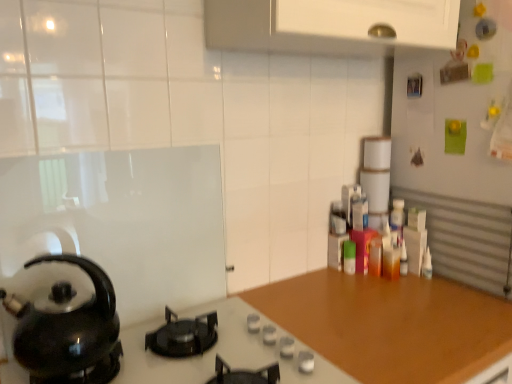
Question: From a real-world perspective, is black glossy kettle at left located beneath black matte gas stove at center?

Choices:
 (A) no
 (B) yes

Answer: (A)

Question: From a real-world perspective, is black glossy kettle at left on top of black matte gas stove at center?

Choices:
 (A) yes
 (B) no

Answer: (A)

Question: Is black glossy kettle at left not within black matte gas stove at center?

Choices:
 (A) no
 (B) yes

Answer: (B)

Question: Considering the relative sizes of black glossy kettle at left and black matte gas stove at center in the image provided, is black glossy kettle at left bigger than black matte gas stove at center?

Choices:
 (A) yes
 (B) no

Answer: (B)

Question: Considering the relative sizes of black glossy kettle at left and black matte gas stove at center in the image provided, is black glossy kettle at left wider than black matte gas stove at center?

Choices:
 (A) yes
 (B) no

Answer: (B)

Question: Is black glossy kettle at left smaller than black matte gas stove at center?

Choices:
 (A) yes
 (B) no

Answer: (A)

Question: Can you confirm if wooden at center is taller than black matte gas stove at center?

Choices:
 (A) yes
 (B) no

Answer: (A)

Question: Is the depth of wooden at center greater than that of black matte gas stove at center?

Choices:
 (A) yes
 (B) no

Answer: (A)

Question: From the image's perspective, would you say wooden at center is positioned over black matte gas stove at center?

Choices:
 (A) yes
 (B) no

Answer: (B)

Question: Is wooden at center to the right of black matte gas stove at center from the viewer's perspective?

Choices:
 (A) no
 (B) yes

Answer: (B)

Question: Can you confirm if wooden at center is thinner than black matte gas stove at center?

Choices:
 (A) yes
 (B) no

Answer: (B)

Question: From a real-world perspective, is wooden at center under black matte gas stove at center?

Choices:
 (A) no
 (B) yes

Answer: (B)

Question: Is wooden at center looking in the opposite direction of black glossy kettle at left?

Choices:
 (A) yes
 (B) no

Answer: (B)